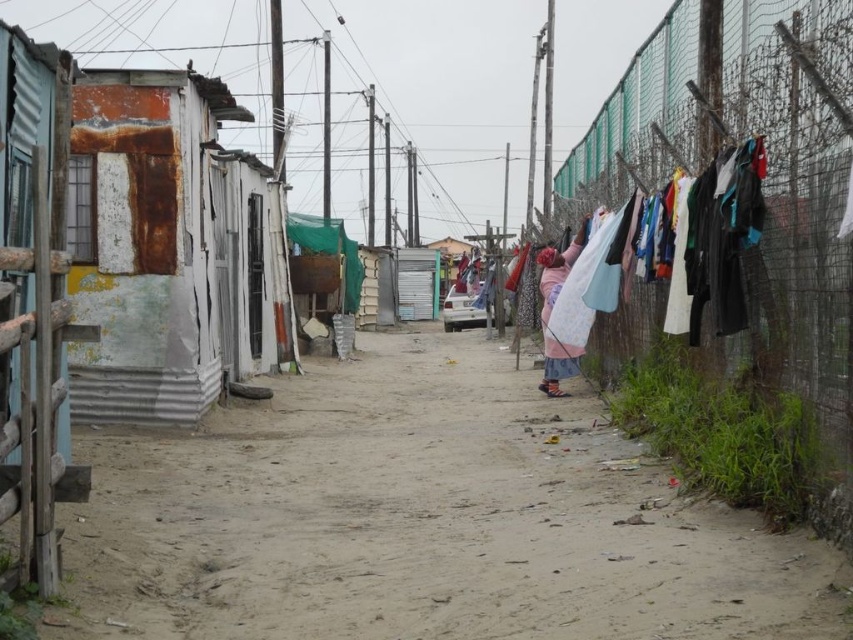
Question: Can you confirm if dirt ground at center is positioned to the left of pink fabric at center?

Choices:
 (A) yes
 (B) no

Answer: (A)

Question: In this image, where is dirt ground at center located relative to rusty metal hut at left?

Choices:
 (A) right
 (B) left

Answer: (A)

Question: Which of the following is the farthest from the observer?

Choices:
 (A) pink fabric at center
 (B) dirt ground at center

Answer: (A)

Question: Can you confirm if rusty metal hut at left is positioned to the right of pink fabric at center?

Choices:
 (A) yes
 (B) no

Answer: (B)

Question: Which object is the farthest from the pink fabric at center?

Choices:
 (A) dirt ground at center
 (B) rusty metal hut at left

Answer: (B)

Question: Which object appears closest to the camera in this image?

Choices:
 (A) pink fabric at center
 (B) dirt ground at center
 (C) rusty metal fence at right
 (D) rusty metal hut at left

Answer: (B)